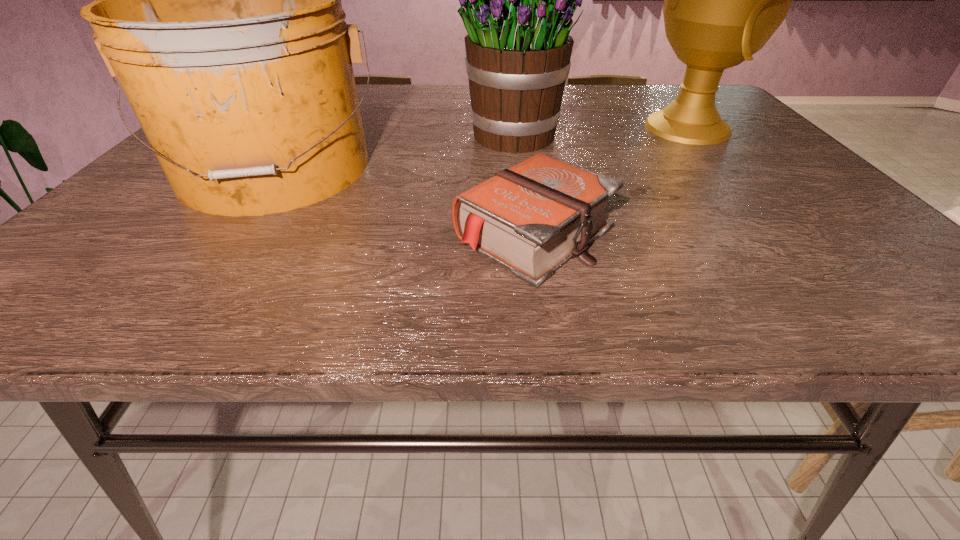
Image resolution: width=960 pixels, height=540 pixels. I want to click on vacant area between the tallest object and the bouquet, so click(600, 131).

Image resolution: width=960 pixels, height=540 pixels. In order to click on vacant area that lies between the leftmost object and the tallest object in this screenshot , I will do `click(481, 148)`.

Where is `vacant area that lies between the rightmost object and the bucket`? The height and width of the screenshot is (540, 960). vacant area that lies between the rightmost object and the bucket is located at coordinates (481, 148).

Identify the location of free space between the leftmost object and the trophy. This screenshot has height=540, width=960. (481, 148).

Locate an element on the screen. This screenshot has height=540, width=960. vacant region between the bouquet and the tallest object is located at coordinates (600, 131).

Identify the location of blank region between the Bible and the bucket. (405, 201).

At what (x,y) coordinates should I click in order to perform the action: click on the closest object to the bucket. Please return your answer as a coordinate pair (x, y). Looking at the image, I should click on (518, 48).

Select which object is the third closest to the bucket. Please provide its 2D coordinates. Your answer should be formatted as a tuple, i.e. [(x, y)], where the tuple contains the x and y coordinates of a point satisfying the conditions above.

[(723, 0)]

This screenshot has width=960, height=540. What are the coordinates of `vacant space that satisfies the following two spatial constraints: 1. on the back side of the bucket; 2. on the left side of the bouquet` in the screenshot? It's located at (300, 136).

At what (x,y) coordinates should I click in order to perform the action: click on vacant space that satisfies the following two spatial constraints: 1. on the front side of the bouquet; 2. on the left side of the shortest object. Please return your answer as a coordinate pair (x, y). This screenshot has height=540, width=960. Looking at the image, I should click on (527, 234).